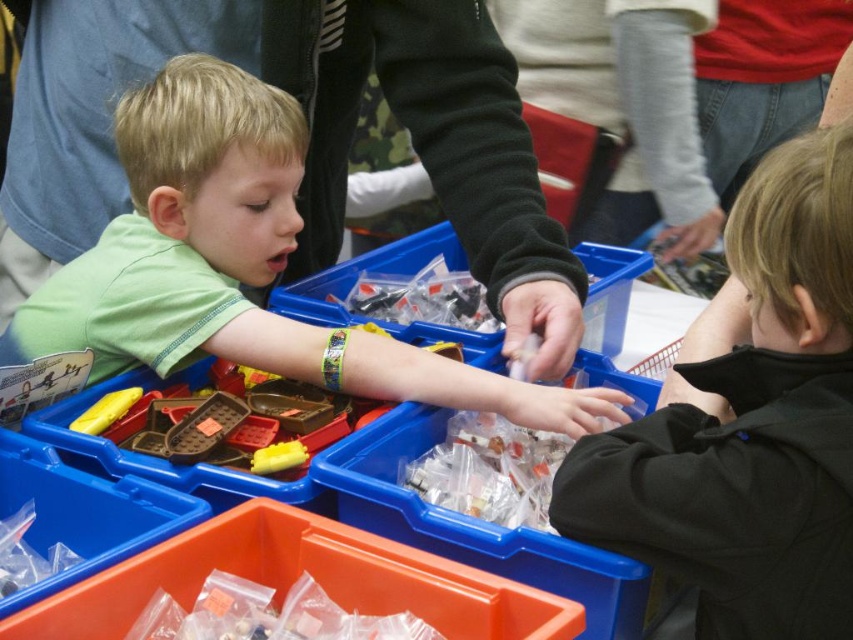
You are a store employee who needs to organize the items. You see the black matte jacket at right and the translucent plastic bag at center. Which item is closer to the right side of the store?

The black matte jacket at right is closer to the right side of the store because it is positioned to the right of the translucent plastic bag at center.

You are a store employee who needs to arrange the items in the bins. You have a limited space on a shelf that can only hold items that are smaller than the green matte shirt at center. Can the black matte jacket at right fit on the shelf?

The black matte jacket at right is smaller than the green matte shirt at center, so it can fit on the shelf since it meets the size requirement.